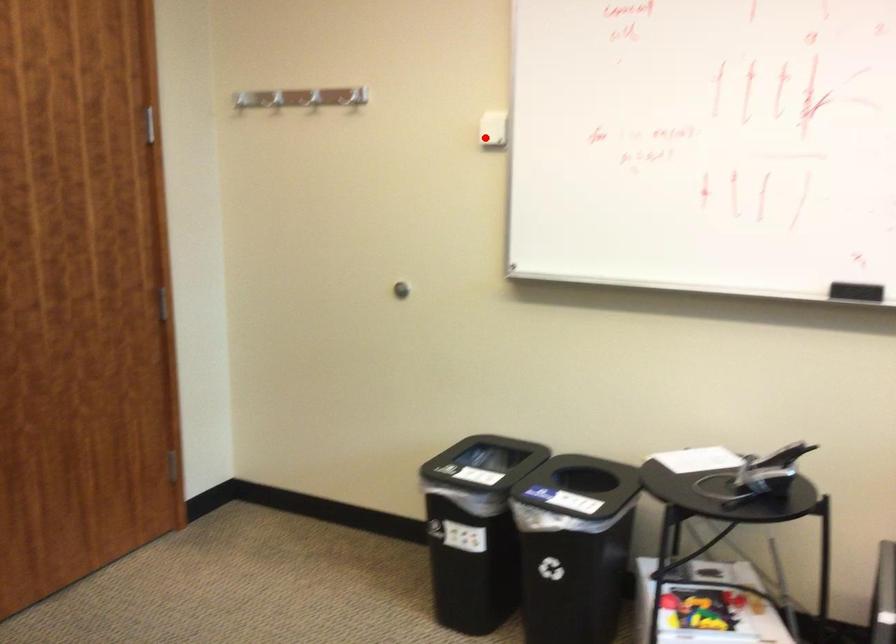
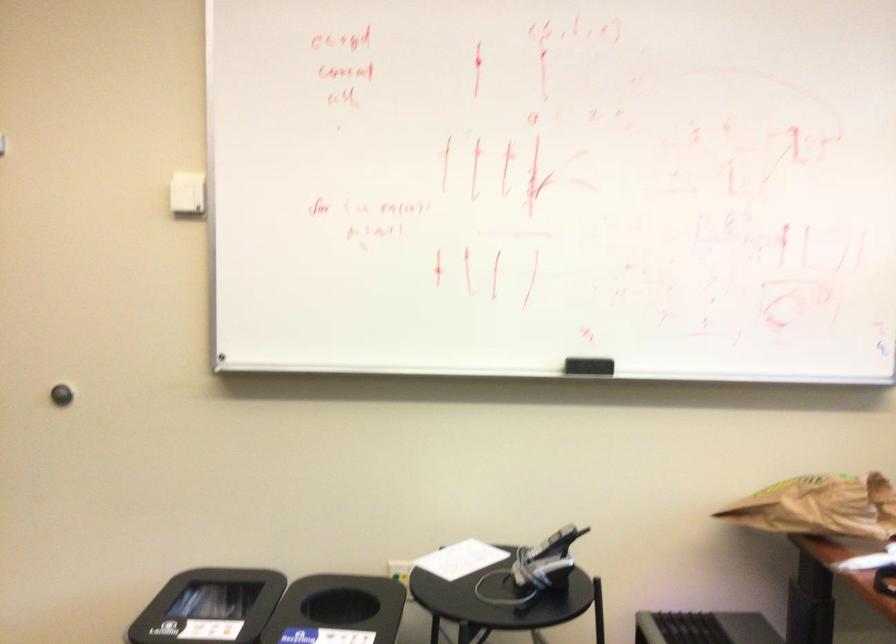
The point at the highlighted location is marked in the first image. Where is the corresponding point in the second image?

(186, 194)